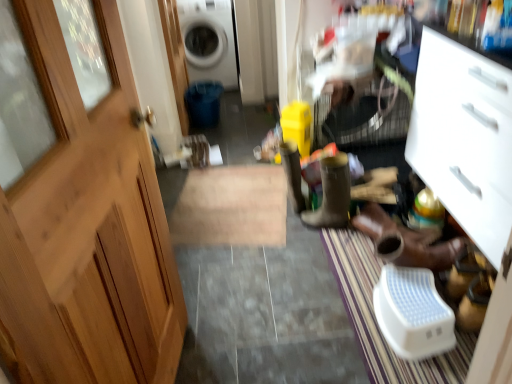
Where is `free space in front of brown leather boot at center, which is counted as the second footwear, starting from the right`? free space in front of brown leather boot at center, which is counted as the second footwear, starting from the right is located at coordinates (312, 251).